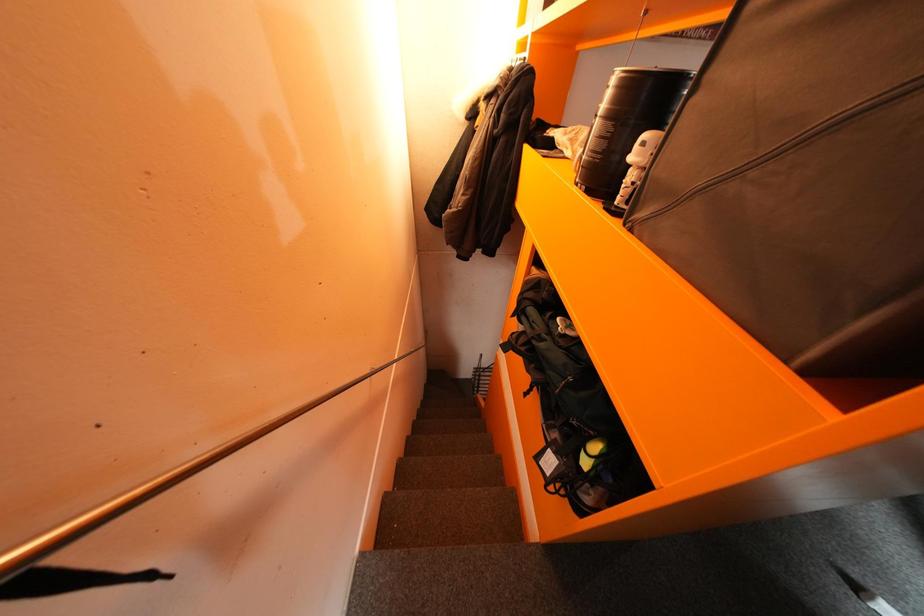
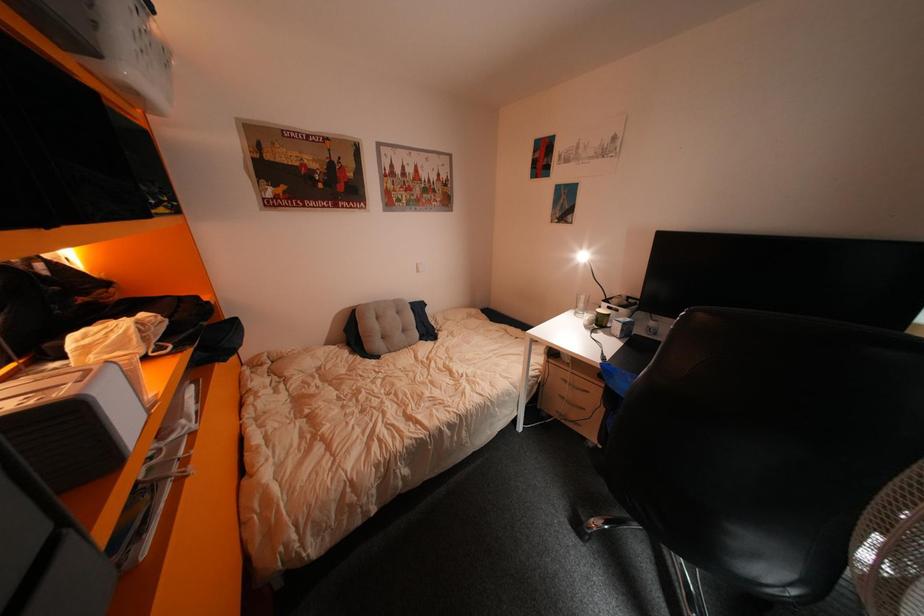
Question: The camera is either moving clockwise (left) or counter-clockwise (right) around the object. The first image is from the beginning of the video and the second image is from the end. Is the camera moving left or right when shooting the video?

Choices:
 (A) Left
 (B) Right

Answer: (A)